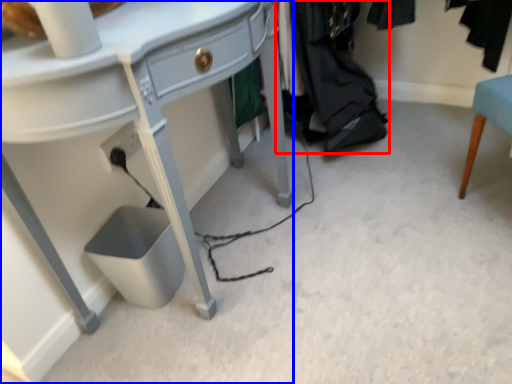
Question: Which object appears farthest to the camera in this image, clothing (highlighted by a red box) or desk (highlighted by a blue box)?

Choices:
 (A) clothing
 (B) desk

Answer: (A)